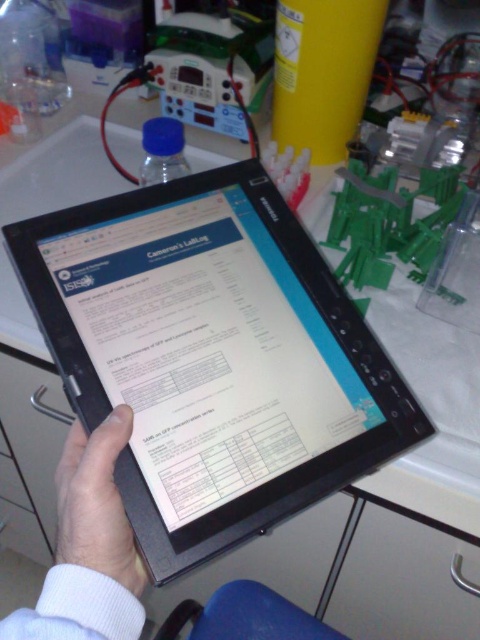
Is black plastic tablet at center above white matte skin at center?

Indeed, black plastic tablet at center is positioned over white matte skin at center.

Is black plastic tablet at center positioned behind white matte skin at center?

Yes, black plastic tablet at center is behind white matte skin at center.

Is point (224, 192) positioned after point (81, 516)?

Yes, point (224, 192) is behind point (81, 516).

At what (x,y) coordinates should I click in order to perform the action: click on black plastic tablet at center. Please return your answer as a coordinate pair (x, y). The height and width of the screenshot is (640, 480). Looking at the image, I should click on (212, 356).

Is black plastic tablet at center closer to the viewer compared to matte black drawer at lower left?

Yes, it is in front of matte black drawer at lower left.

Is black plastic tablet at center taller than matte black drawer at lower left?

Incorrect, black plastic tablet at center's height is not larger of matte black drawer at lower left's.

Where is `black plastic tablet at center`? This screenshot has width=480, height=640. black plastic tablet at center is located at coordinates (212, 356).

Can you confirm if white matte skin at center is positioned above matte black drawer at lower left?

Yes.

Image resolution: width=480 pixels, height=640 pixels. In order to click on white matte skin at center in this screenshot , I will do `click(96, 502)`.

Describe the element at coordinates (96, 502) in the screenshot. I see `white matte skin at center` at that location.

Find the location of a particular element. Image resolution: width=480 pixels, height=640 pixels. white matte skin at center is located at coordinates (96, 502).